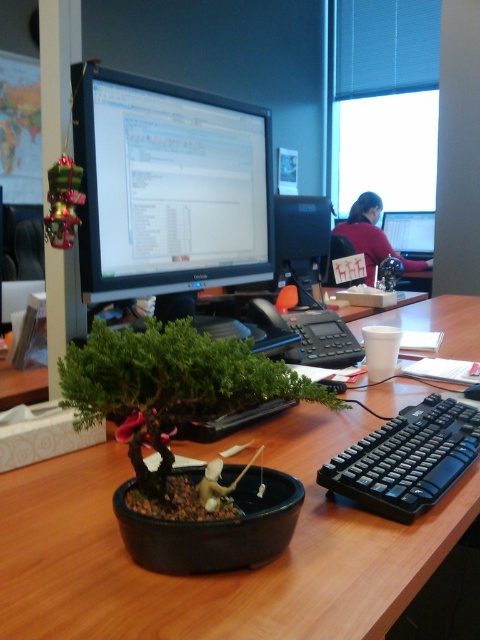
Question: Does brown wood computer desk at center appear on the left side of matte black monitor at center?

Choices:
 (A) yes
 (B) no

Answer: (B)

Question: Is black plastic desktop computer at center closer to camera compared to matte black monitor at upper center?

Choices:
 (A) no
 (B) yes

Answer: (B)

Question: Can you confirm if matte black monitor at center is bigger than black plastic keyboard at right?

Choices:
 (A) yes
 (B) no

Answer: (A)

Question: Among these points, which one is farthest from the camera?

Choices:
 (A) (406, 253)
 (B) (220, 244)
 (C) (403, 436)

Answer: (A)

Question: Which point is closer to the camera?

Choices:
 (A) (170, 272)
 (B) (375, 452)

Answer: (B)

Question: Among these points, which one is farthest from the camera?

Choices:
 (A) (63, 630)
 (B) (222, 364)

Answer: (B)